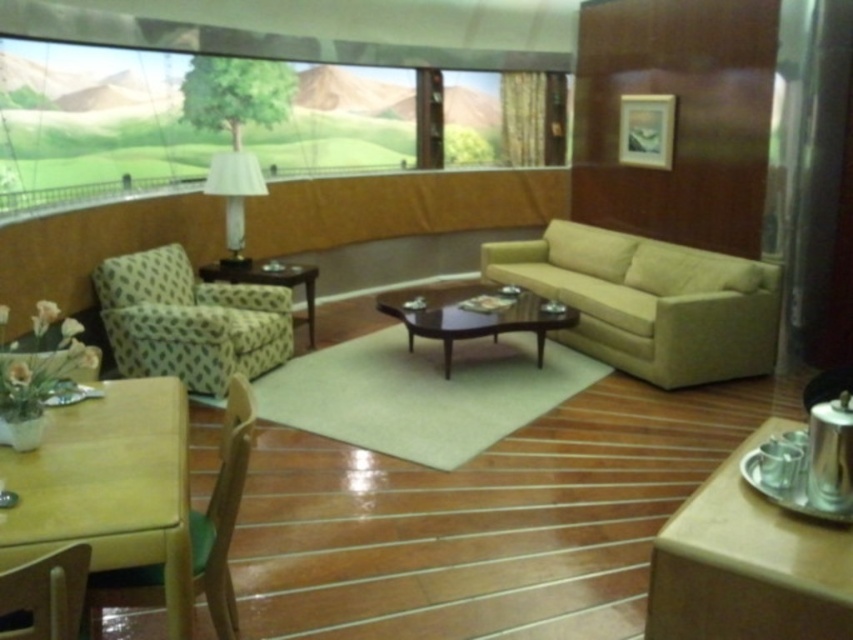
Does point (747, 346) come behind point (674, 637)?

Yes, it is behind point (674, 637).

Does point (770, 355) lie in front of point (772, 528)?

That is False.

Who is more forward, (650,314) or (759,584)?

Point (759,584) is in front.

Find the location of a particular element. beige fabric couch at center is located at coordinates (648, 301).

Based on the photo, which is more to the left, white fabric lampshade at upper center or wooden glossy side table at center?

white fabric lampshade at upper center

Can you confirm if white fabric lampshade at upper center is taller than wooden glossy side table at center?

Yes.

Find the location of `white fabric lampshade at upper center`. white fabric lampshade at upper center is located at coordinates (234, 195).

Can you confirm if green fabric armchair at left is taller than wooden glossy side table at center?

Correct, green fabric armchair at left is much taller as wooden glossy side table at center.

Which is in front, point (134, 305) or point (299, 282)?

Point (134, 305) is more forward.

This screenshot has width=853, height=640. What do you see at coordinates (189, 321) in the screenshot? I see `green fabric armchair at left` at bounding box center [189, 321].

Where is `green fabric armchair at left`? This screenshot has height=640, width=853. green fabric armchair at left is located at coordinates (189, 321).